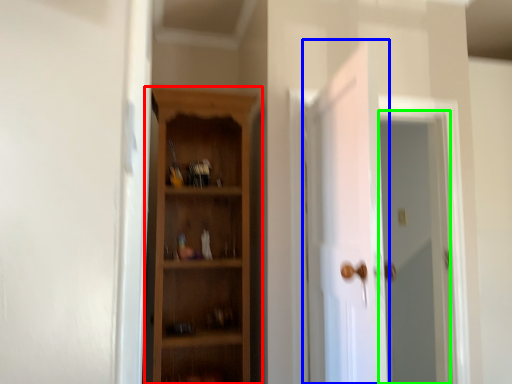
Question: Which object is positioned closest to cupboard (highlighted by a red box)? Select from door (highlighted by a blue box) and screen door (highlighted by a green box).

Choices:
 (A) door
 (B) screen door

Answer: (A)